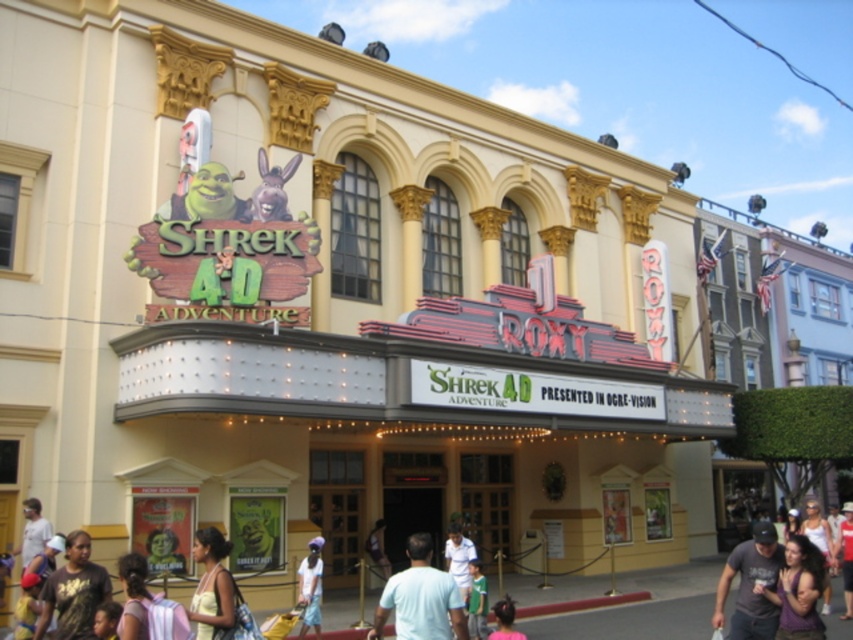
You are a customer standing in front of the Roxy theater entrance. You notice two items of clothing at the center of the entrance area. Which one is bigger between the light blue denim shorts at center and the light blue shirt at center?

The light blue denim shorts at center is larger in size than the light blue shirt at center.

You are a theater usher who needs to guide a guest to the entrance. The guest is wearing a matte black shirt at lower left and is standing in front of a light blue shirt at center. Which shirt should you look for first to locate the guest?

The guest wearing the matte black shirt at lower left is in front of the light blue shirt at center, so you should look for the matte black shirt at lower left first to locate the guest.